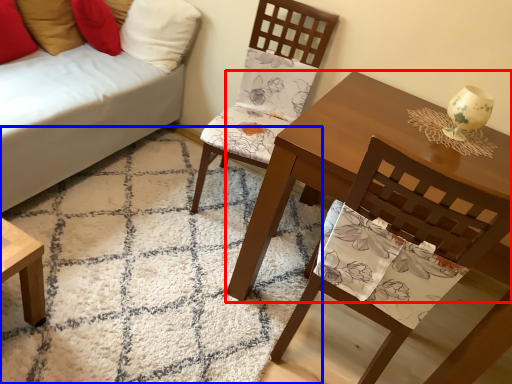
Question: Which object appears closest to the camera in this image, table (highlighted by a red box) or mat (highlighted by a blue box)?

Choices:
 (A) table
 (B) mat

Answer: (B)